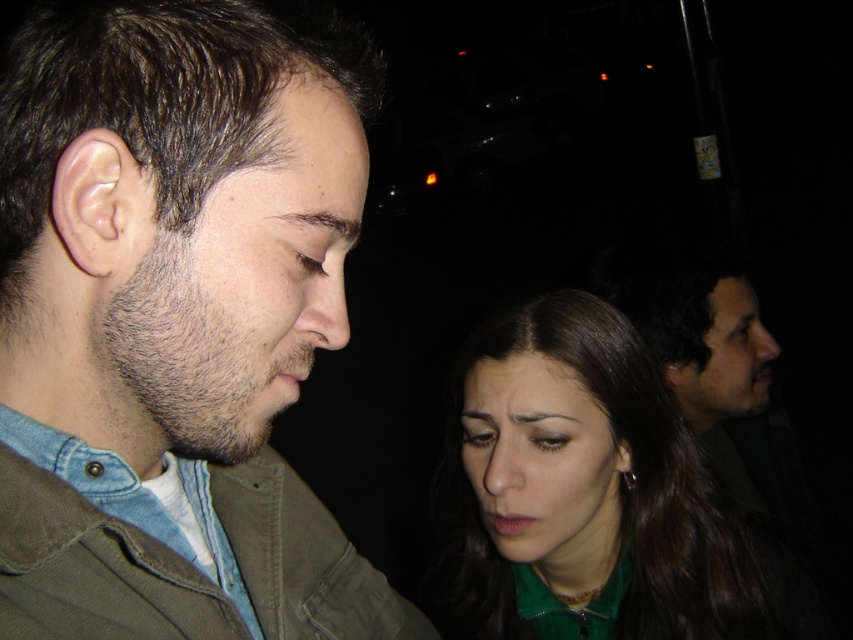
Question: Is denim jacket at left bigger than dark brown hair at right?

Choices:
 (A) yes
 (B) no

Answer: (A)

Question: Where is denim jacket at left located in relation to dark brown hair at right in the image?

Choices:
 (A) right
 (B) left

Answer: (B)

Question: Which of the following is the closest to the observer?

Choices:
 (A) (706, 275)
 (B) (648, 568)
 (C) (321, 132)

Answer: (C)

Question: Which of the following is the farthest from the observer?

Choices:
 (A) denim jacket at left
 (B) green matte shirt at lower right
 (C) dark brown hair at upper center

Answer: (B)

Question: In this image, where is denim jacket at left located relative to dark brown hair at upper center?

Choices:
 (A) right
 (B) left

Answer: (B)

Question: Which object is positioned farthest from the green matte shirt at lower right?

Choices:
 (A) dark brown hair at upper center
 (B) denim jacket at left
 (C) dark brown hair at right

Answer: (C)